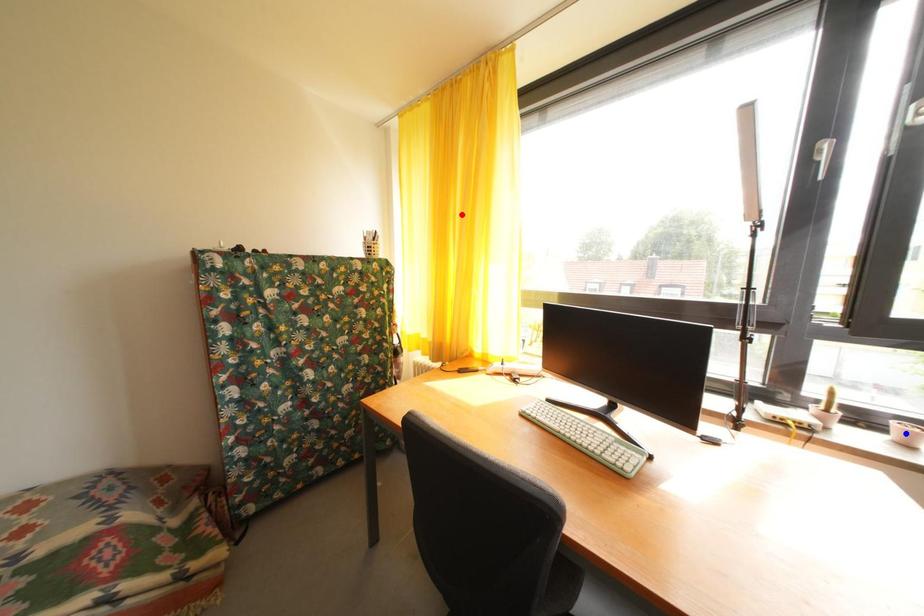
Question: Two points are marked on the image. Which point is closer to the camera?

Choices:
 (A) Blue point is closer.
 (B) Red point is closer.

Answer: (A)